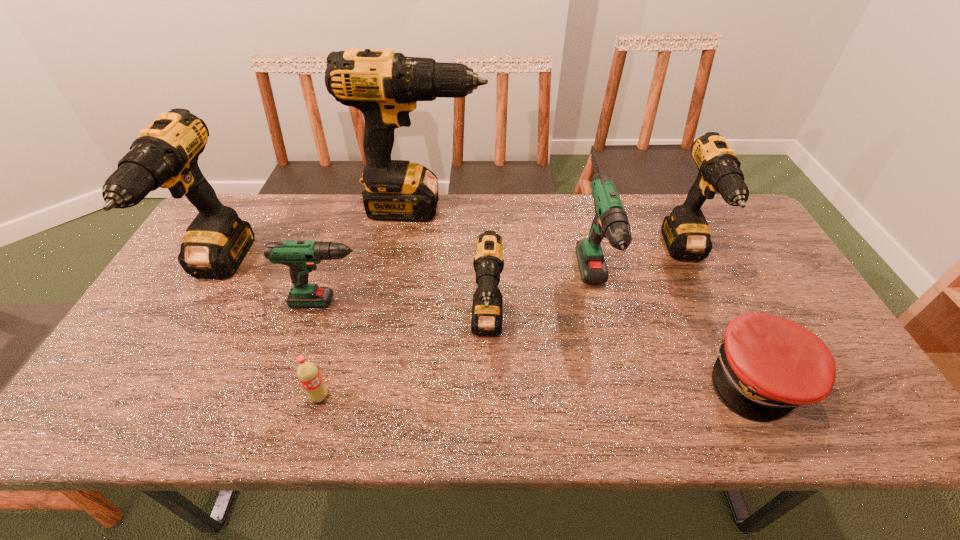
This screenshot has height=540, width=960. What are the coordinates of `the left green drill` in the screenshot? It's located at (300, 256).

Locate an element on the screen. The height and width of the screenshot is (540, 960). soda is located at coordinates (308, 374).

Find the location of a particular element. Image resolution: width=960 pixels, height=540 pixels. red soda is located at coordinates (308, 374).

Locate an element on the screen. The width and height of the screenshot is (960, 540). red cap is located at coordinates (766, 366).

Image resolution: width=960 pixels, height=540 pixels. What are the coordinates of `cap` in the screenshot? It's located at (766, 366).

Where is `vacant space located at the tip of the farthest object`? This screenshot has width=960, height=540. vacant space located at the tip of the farthest object is located at coordinates (569, 208).

The height and width of the screenshot is (540, 960). What are the coordinates of `blank area located 0.160m at the tip of the leftmost object` in the screenshot? It's located at (157, 372).

Locate an element on the screen. The width and height of the screenshot is (960, 540). free spot located 0.280m at the tip of the second smallest black drill is located at coordinates (745, 378).

You are a GUI agent. You are given a task and a screenshot of the screen. Output one action in this format:
    pyautogui.click(x=<x>, y=<y>)
    Task: Click on the free space located 0.150m on the handle side of the right green drill
    This screenshot has height=540, width=960.
    Given the screenshot: What is the action you would take?
    pyautogui.click(x=620, y=393)

This screenshot has height=540, width=960. Identify the location of blank area located 0.050m at the tip of the smallest black drill. (488, 384).